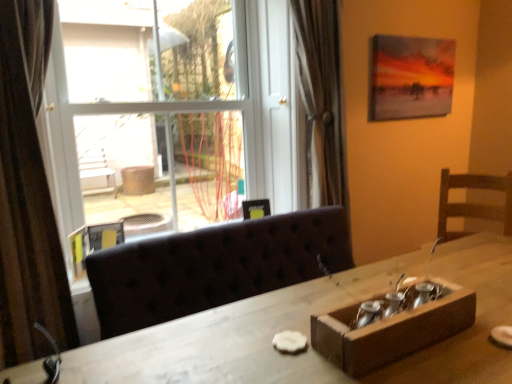
At what (x,y) coordinates should I click in order to perform the action: click on free space in front of wooden box at lower right. Please return your answer as a coordinate pair (x, y). This screenshot has height=384, width=512. Looking at the image, I should click on (426, 368).